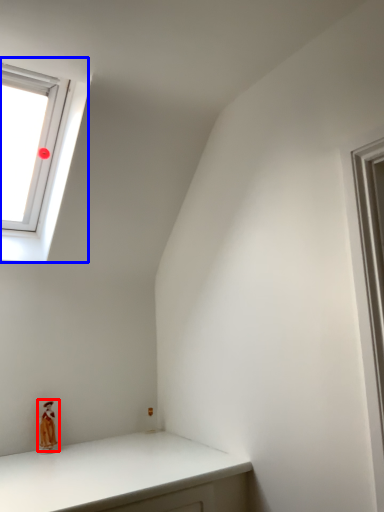
Question: Among these objects, which one is nearest to the camera, doll (highlighted by a red box) or window (highlighted by a blue box)?

Choices:
 (A) doll
 (B) window

Answer: (B)